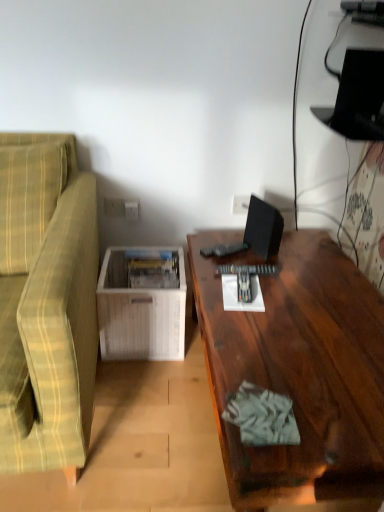
The image size is (384, 512). Find the location of `vacant area that lies in front of black matte computer monitor at upper right`. vacant area that lies in front of black matte computer monitor at upper right is located at coordinates [278, 270].